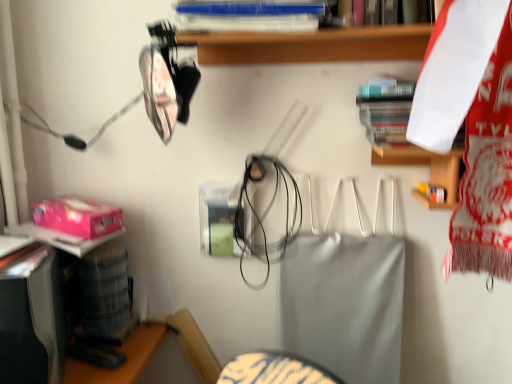
Question: Considering the relative sizes of blue plastic book at upper center, which is the second book in bottom-to-top order, and hardcover book at upper right, which ranks as the 1th book in bottom-to-top order, in the image provided, is blue plastic book at upper center, which is the second book in bottom-to-top order, thinner than hardcover book at upper right, which ranks as the 1th book in bottom-to-top order,?

Choices:
 (A) yes
 (B) no

Answer: (B)

Question: Is the position of blue plastic book at upper center, the 1th book when ordered from left to right, more distant than that of hardcover book at upper right, which appears as the 2th book when viewed from the left?

Choices:
 (A) yes
 (B) no

Answer: (B)

Question: Can you confirm if blue plastic book at upper center, the 1th book when ordered from left to right, is positioned to the right of hardcover book at upper right, which is the 2th book from top to bottom?

Choices:
 (A) yes
 (B) no

Answer: (B)

Question: From a real-world perspective, is blue plastic book at upper center, the 1th book when ordered from left to right, below hardcover book at upper right, which is the 2th book from top to bottom?

Choices:
 (A) yes
 (B) no

Answer: (B)

Question: From the image's perspective, is blue plastic book at upper center, the 1th book when ordered from left to right, below hardcover book at upper right, which is the 2th book from top to bottom?

Choices:
 (A) no
 (B) yes

Answer: (A)

Question: Considering the positions of hardcover book at upper right, which appears as the 2th book when viewed from the left, and blue plastic book at upper center, the 1th book when ordered from left to right, in the image, is hardcover book at upper right, which appears as the 2th book when viewed from the left, bigger or smaller than blue plastic book at upper center, the 1th book when ordered from left to right,?

Choices:
 (A) big
 (B) small

Answer: (B)

Question: Is point (384, 110) positioned closer to the camera than point (176, 11)?

Choices:
 (A) farther
 (B) closer

Answer: (A)

Question: Considering their positions, is hardcover book at upper right, which ranks as the 1th book in bottom-to-top order, located in front of or behind blue plastic book at upper center, which is the second book in bottom-to-top order?

Choices:
 (A) behind
 (B) front

Answer: (A)

Question: Is hardcover book at upper right, which appears as the 2th book when viewed from the left, taller or shorter than blue plastic book at upper center, the 1th book when ordered from left to right?

Choices:
 (A) short
 (B) tall

Answer: (B)

Question: From a real-world perspective, is hardcover book at upper right, which ranks as the 1th book in bottom-to-top order, positioned above or below pink matte box at lower left?

Choices:
 (A) above
 (B) below

Answer: (A)

Question: From the image's perspective, is hardcover book at upper right, arranged as the 1th book when viewed from the right, above or below pink matte box at lower left?

Choices:
 (A) below
 (B) above

Answer: (B)

Question: Is point (399, 142) positioned closer to the camera than point (96, 216)?

Choices:
 (A) farther
 (B) closer

Answer: (B)

Question: Based on their positions, is hardcover book at upper right, which appears as the 2th book when viewed from the left, located to the left or right of pink matte box at lower left?

Choices:
 (A) left
 (B) right

Answer: (B)

Question: From the image's perspective, is blue plastic book at upper center, the 1th book when ordered from left to right, above or below hardcover book at upper right, which is the 2th book from top to bottom?

Choices:
 (A) below
 (B) above

Answer: (B)

Question: Is point click(179, 23) positioned closer to the camera than point click(413, 92)?

Choices:
 (A) closer
 (B) farther

Answer: (A)